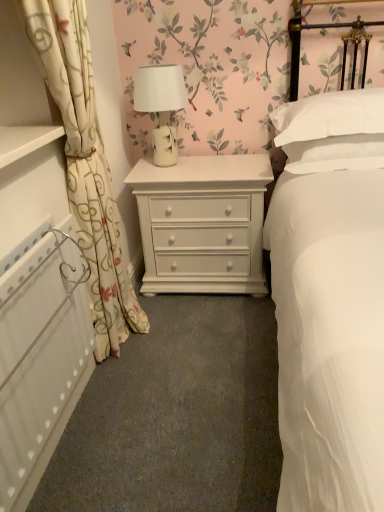
Where is `vacant area on top of white painted wood chest of drawers at center (from a real-world perspective)`? vacant area on top of white painted wood chest of drawers at center (from a real-world perspective) is located at coordinates (206, 161).